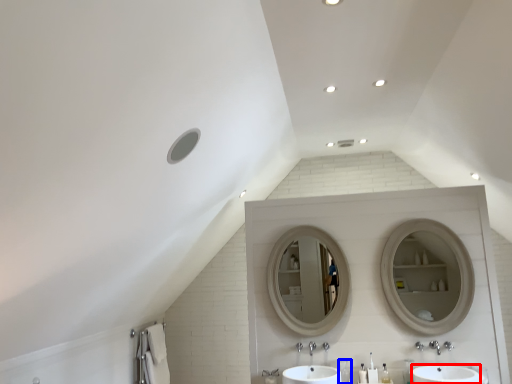
Question: Which point is closer to the camera, sink (highlighted by a red box) or toiletry (highlighted by a blue box)?

Choices:
 (A) sink
 (B) toiletry

Answer: (A)